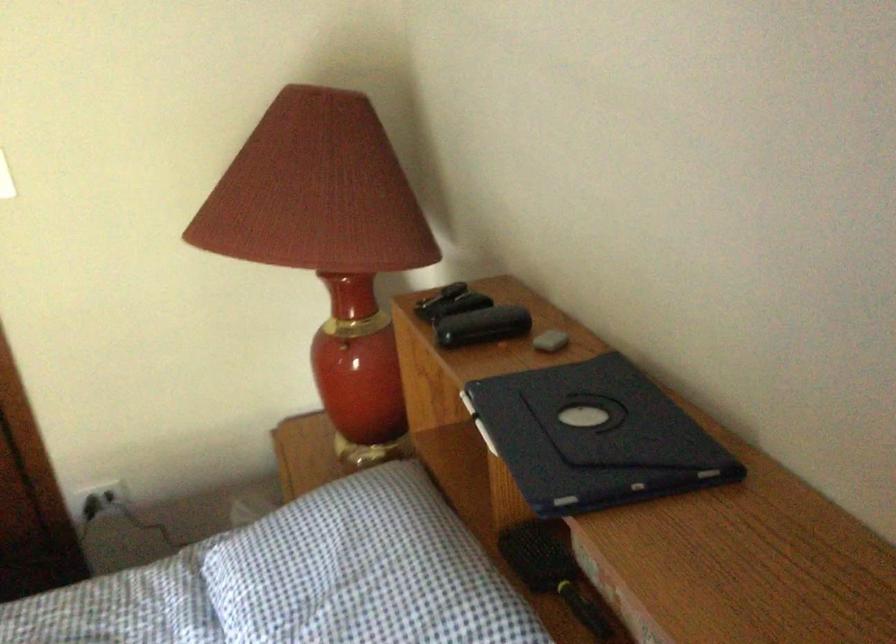
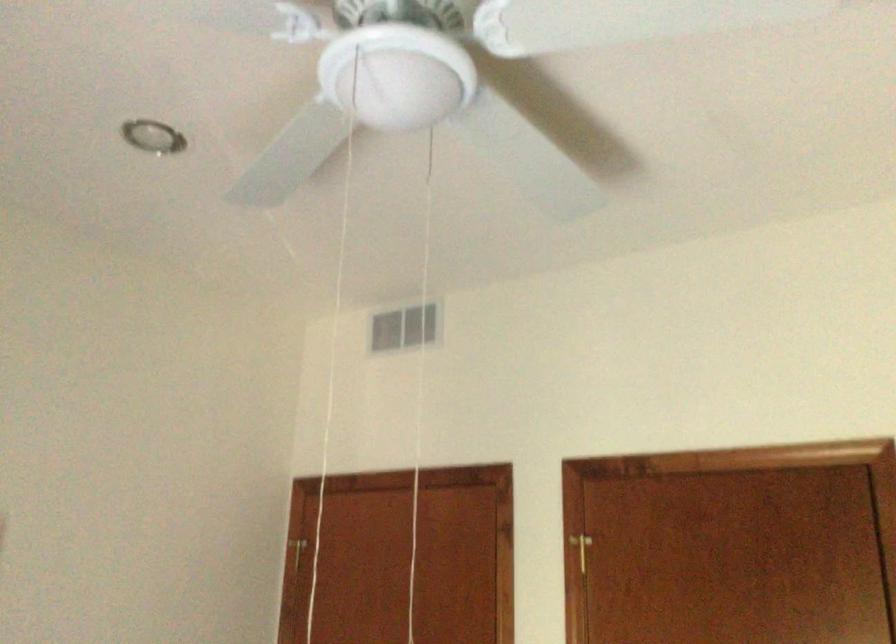
The images are taken continuously from a first-person perspective. In which direction is your viewpoint rotating?

The camera rotated toward left-up.